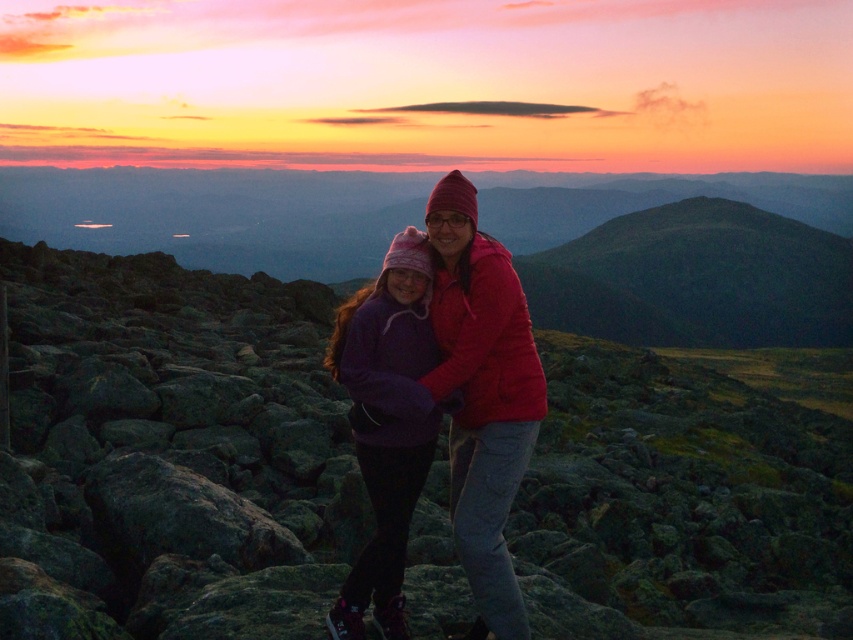
In the scene shown: You are a hiker planning to place a 2 meter long safety rope between the rocky terrain at center and the matte pink hat at center. Is the distance sufficient to place the rope without it being too tight or too loose?

The rocky terrain at center is 5.74 meters from the matte pink hat at center. Since the rope is 2 meters long, the distance between them is more than enough to place the rope comfortably without it being too tight or too loose.

You are planning to hike across the rocky terrain at center and the green grassy hill at center. Which path would allow you to walk further without needing to turn around, based on their widths?

The green grassy hill at center has a wider width than the rocky terrain at center, so you can walk further on the green grassy hill at center without needing to turn around.

You are a hiker planning to walk from the rocky terrain at center to the green grassy hill at center. Based on the scene description, which direction should you head towards?

The rocky terrain at center is in front of the green grassy hill at center, so you should head towards the direction away from the rocky terrain at center to reach the green grassy hill at center.